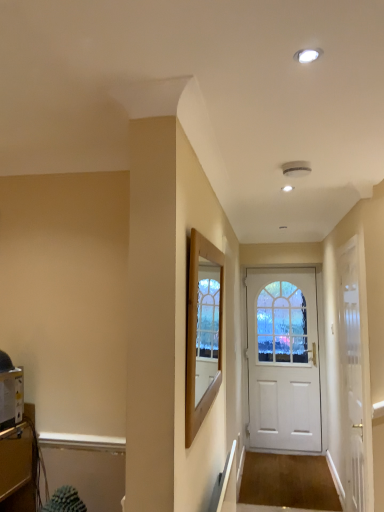
Question: Is wooden frame at center taller or shorter than white matte door at center, marked as the first door in a back-to-front arrangement?

Choices:
 (A) tall
 (B) short

Answer: (B)

Question: From a real-world perspective, is wooden frame at center above or below white matte door at center, the second door from the front?

Choices:
 (A) above
 (B) below

Answer: (A)

Question: Which object is the closest to the metallic silver toaster at lower left?

Choices:
 (A) wooden frame at center
 (B) white matte door at center, marked as the first door in a back-to-front arrangement
 (C) white glossy door at center, which is the 2th door from back to front

Answer: (A)

Question: Considering the real-world distances, which object is farthest from the white matte door at center, the second door from the front?

Choices:
 (A) metallic silver toaster at lower left
 (B) wooden frame at center
 (C) white glossy door at center, acting as the 1th door starting from the front

Answer: (A)